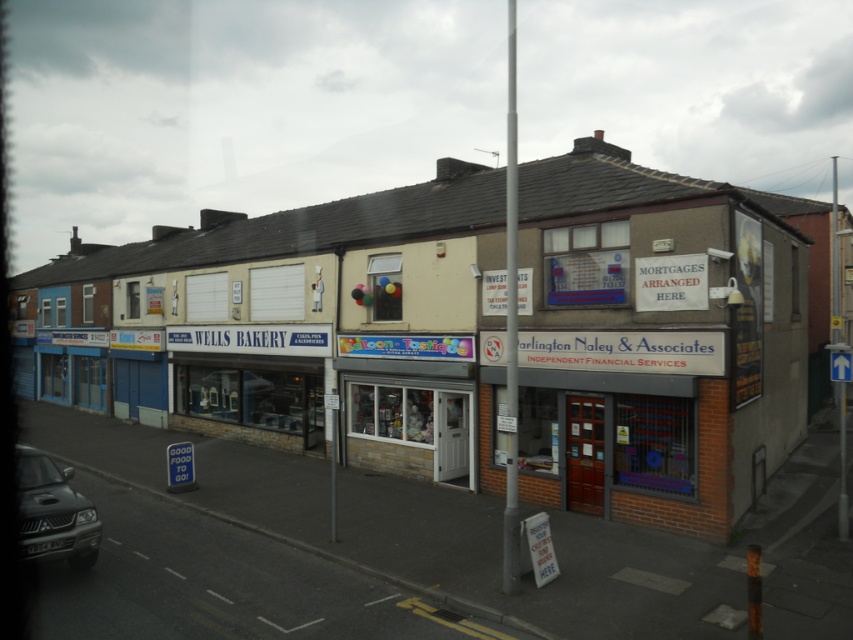
Is matte black car at lower left bigger than metallic pole at center?

No, matte black car at lower left is not bigger than metallic pole at center.

Does matte black car at lower left appear under metallic pole at center?

Indeed, matte black car at lower left is positioned under metallic pole at center.

At what (x,y) coordinates should I click in order to perform the action: click on matte black car at lower left. Please return your answer as a coordinate pair (x, y). Looking at the image, I should click on (53, 513).